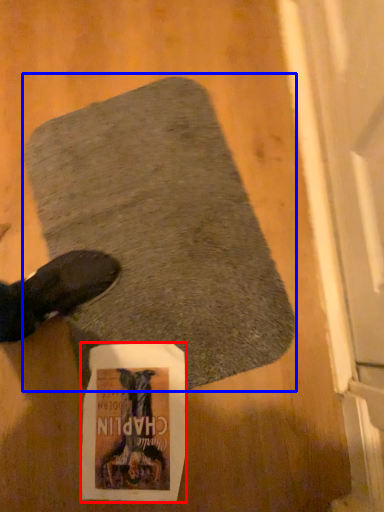
Question: Which point is further to the camera, flyer (highlighted by a red box) or mat (highlighted by a blue box)?

Choices:
 (A) flyer
 (B) mat

Answer: (A)